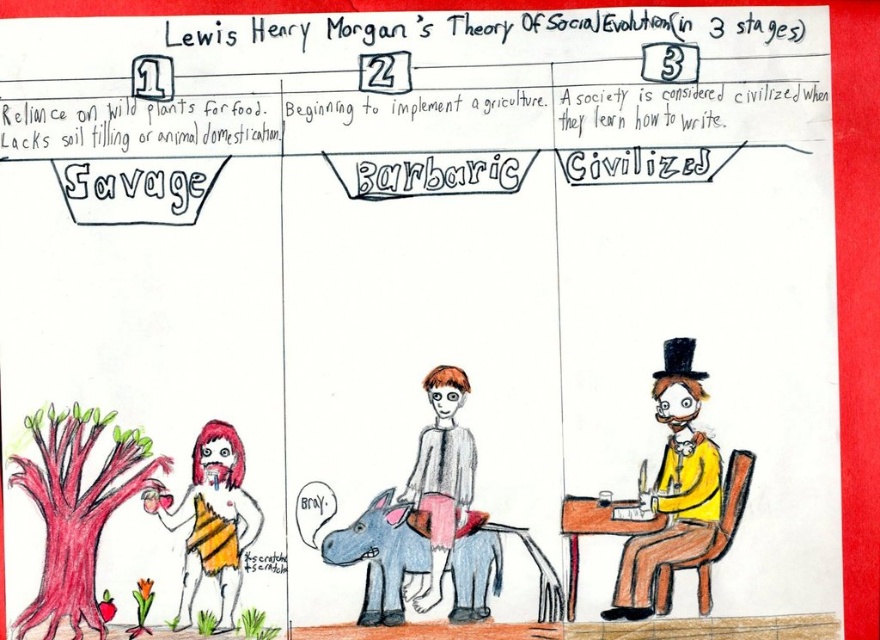
Question: Which point is farther to the camera?

Choices:
 (A) (x=683, y=356)
 (B) (x=86, y=563)
 (C) (x=422, y=488)
 (D) (x=200, y=524)

Answer: (C)

Question: Is reddish-brown textured tree at lower left to the right of light brown paper bag at center from the viewer's perspective?

Choices:
 (A) yes
 (B) no

Answer: (B)

Question: Can you confirm if reddish-brown textured tree at lower left is bigger than striped fabric figure at lower left?

Choices:
 (A) no
 (B) yes

Answer: (B)

Question: Which point is farther to the camera?

Choices:
 (A) (66, 538)
 (B) (240, 557)
 (C) (677, 506)
 (D) (429, 445)

Answer: (C)

Question: Which object is positioned farthest from the yellow matte suit at center right?

Choices:
 (A) striped fabric figure at lower left
 (B) reddish-brown textured tree at lower left
 (C) light brown paper bag at center

Answer: (B)

Question: Does yellow matte suit at center right come behind light brown paper bag at center?

Choices:
 (A) no
 (B) yes

Answer: (B)